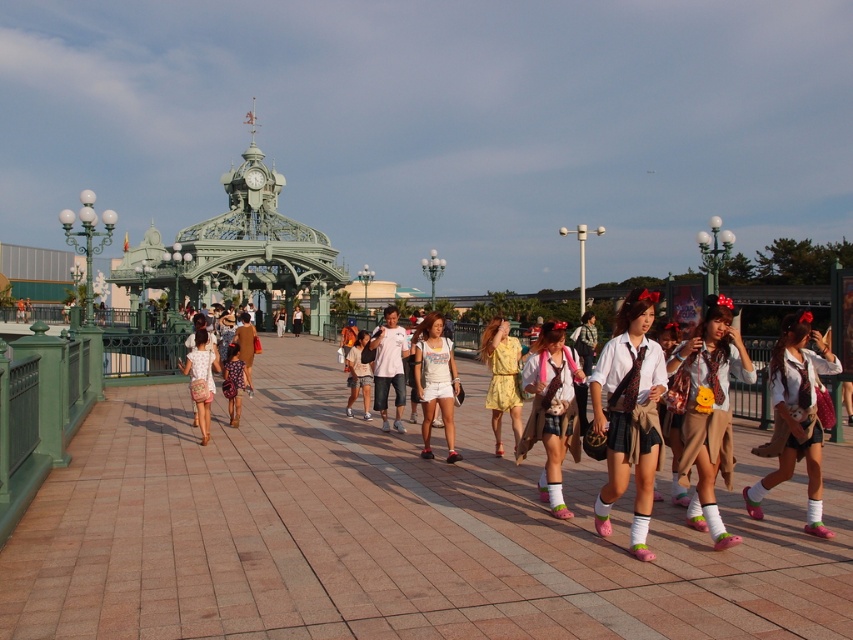
Which is in front, point (502, 364) or point (225, 369)?

Point (502, 364) is in front.

Does yellow fabric dress at center appear on the right side of dotted fabric skirt at center?

Correct, you'll find yellow fabric dress at center to the right of dotted fabric skirt at center.

Does point (492, 378) lie in front of point (223, 364)?

Yes.

Locate an element on the screen. yellow fabric dress at center is located at coordinates (502, 378).

Is matte white blouse at center smaller than white cotton shirt at center?

No, matte white blouse at center is not smaller than white cotton shirt at center.

Can you confirm if matte white blouse at center is positioned to the right of white cotton shirt at center?

Indeed, matte white blouse at center is positioned on the right side of white cotton shirt at center.

You are a GUI agent. You are given a task and a screenshot of the screen. Output one action in this format:
    pyautogui.click(x=<x>, y=<y>)
    Task: Click on the matte white blouse at center
    
    Given the screenshot: What is the action you would take?
    pyautogui.click(x=795, y=417)

Between paved brick walkway at center and matte beige skirt at center, which one appears on the left side from the viewer's perspective?

From the viewer's perspective, paved brick walkway at center appears more on the left side.

Which of these two, paved brick walkway at center or matte beige skirt at center, stands taller?

Standing taller between the two is matte beige skirt at center.

The width and height of the screenshot is (853, 640). Describe the element at coordinates (387, 532) in the screenshot. I see `paved brick walkway at center` at that location.

Find the location of a particular element. This screenshot has height=640, width=853. paved brick walkway at center is located at coordinates (387, 532).